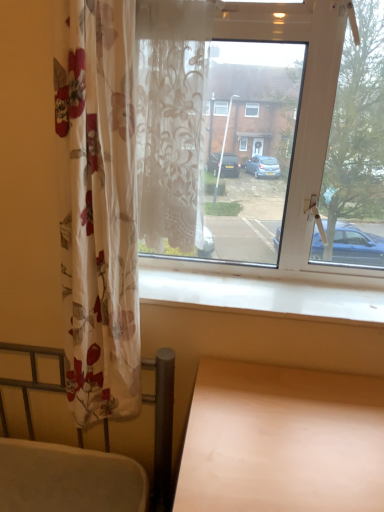
Question: From a real-world perspective, relative to white smooth window sill at lower center, is transparent glass window at center vertically above or below?

Choices:
 (A) below
 (B) above

Answer: (B)

Question: Considering their positions, is transparent glass window at center located in front of or behind white smooth window sill at lower center?

Choices:
 (A) behind
 (B) front

Answer: (B)

Question: Estimate the real-world distances between objects in this image. Which object is closer to the light wood table at lower right?

Choices:
 (A) translucent floral curtain at center
 (B) transparent glass window at center
 (C) white smooth window sill at lower center

Answer: (C)

Question: Estimate the real-world distances between objects in this image. Which object is closer to the white smooth window sill at lower center?

Choices:
 (A) transparent glass window at center
 (B) translucent floral curtain at center
 (C) light wood table at lower right

Answer: (A)